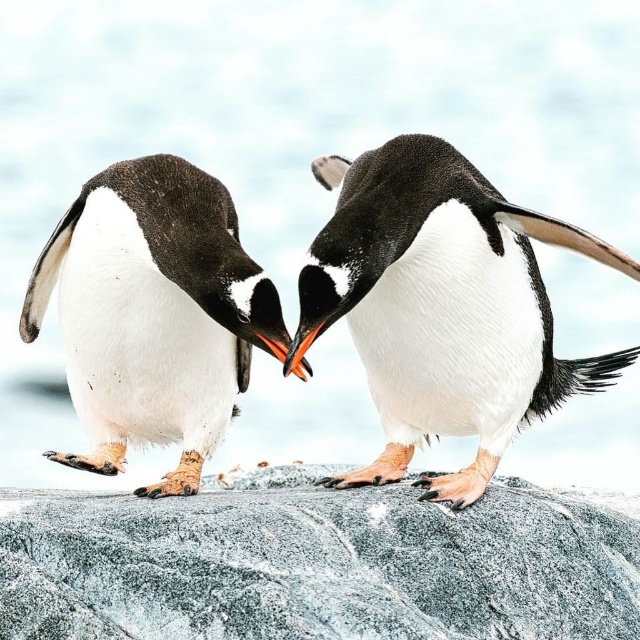
How much distance is there between white fluffy penguin at center and white matte penguin at left?

white fluffy penguin at center is 40.60 centimeters from white matte penguin at left.

How far apart are white fluffy penguin at center and white matte penguin at left?

white fluffy penguin at center is 15.99 inches away from white matte penguin at left.

Which is behind, point (324, 276) or point (202, 218)?

Positioned behind is point (202, 218).

Identify the location of white fluffy penguin at center. This screenshot has height=640, width=640. click(442, 305).

This screenshot has height=640, width=640. What do you see at coordinates (317, 563) in the screenshot?
I see `gray granite rock at center` at bounding box center [317, 563].

Does gray granite rock at center have a larger size compared to white fluffy penguin at center?

Yes.

Which is in front, point (547, 524) or point (576, 243)?

Point (576, 243) is more forward.

The image size is (640, 640). I want to click on gray granite rock at center, so click(317, 563).

Based on the photo, can you confirm if gray granite rock at center is wider than white matte penguin at left?

Yes, gray granite rock at center is wider than white matte penguin at left.

Is gray granite rock at center thinner than white matte penguin at left?

No.

Which is behind, point (118, 579) or point (225, 236)?

The point (225, 236) is more distant.

Locate an element on the screen. Image resolution: width=640 pixels, height=640 pixels. gray granite rock at center is located at coordinates (317, 563).